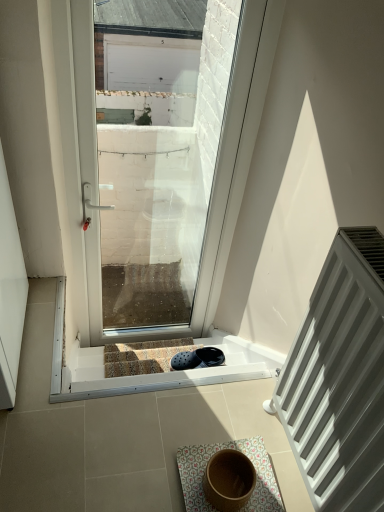
Describe the element at coordinates (143, 356) in the screenshot. This screenshot has width=384, height=512. I see `carpeted stairs at center` at that location.

What is the approximate height of white matte radiator at right?

It is 27.67 inches.

Where is `transparent glass door at center`? The height and width of the screenshot is (512, 384). transparent glass door at center is located at coordinates (162, 162).

Considering the sizes of floral fabric bath mat at center and transparent glass door at center in the image, is floral fabric bath mat at center taller or shorter than transparent glass door at center?

Considering their sizes, floral fabric bath mat at center has less height than transparent glass door at center.

Which is more to the left, floral fabric bath mat at center or transparent glass door at center?

From the viewer's perspective, transparent glass door at center appears more on the left side.

I want to click on bath mat that is on the right side of transparent glass door at center, so click(x=206, y=465).

Does floral fabric bath mat at center turn towards transparent glass door at center?

No, floral fabric bath mat at center is not oriented towards transparent glass door at center.

Is transparent glass door at center bigger than white matte radiator at right?

Correct, transparent glass door at center is larger in size than white matte radiator at right.

Which is more to the left, transparent glass door at center or white matte radiator at right?

From the viewer's perspective, transparent glass door at center appears more on the left side.

Is transparent glass door at center facing towards white matte radiator at right?

Yes, transparent glass door at center faces towards white matte radiator at right.

Based on the photo, can you confirm if transparent glass door at center is shorter than white matte radiator at right?

No, transparent glass door at center is not shorter than white matte radiator at right.

Considering the relative positions of floral fabric bath mat at center and white matte radiator at right in the image provided, is floral fabric bath mat at center to the right of white matte radiator at right from the viewer's perspective?

No, floral fabric bath mat at center is not to the right of white matte radiator at right.

Which is closer, (x=247, y=505) or (x=349, y=338)?

The point (x=349, y=338) is closer to the camera.

From a real-world perspective, between floral fabric bath mat at center and white matte radiator at right, who is vertically lower?

floral fabric bath mat at center is physically lower.

How many degrees apart are the facing directions of white matte radiator at right and carpeted stairs at center?

90 degrees separate the facing orientations of white matte radiator at right and carpeted stairs at center.

Considering the positions of objects white matte radiator at right and carpeted stairs at center in the image provided, who is more to the right, white matte radiator at right or carpeted stairs at center?

white matte radiator at right.

Is white matte radiator at right oriented away from carpeted stairs at center?

No, white matte radiator at right is not facing away from carpeted stairs at center.

Would you say transparent glass door at center is outside floral fabric bath mat at center?

Yes, transparent glass door at center is located beyond the bounds of floral fabric bath mat at center.

Does transparent glass door at center have a lesser height compared to floral fabric bath mat at center?

No.

Locate an element on the screen. This screenshot has height=512, width=384. bath mat that is under the transparent glass door at center (from a real-world perspective) is located at coordinates (206, 465).

Are transparent glass door at center and floral fabric bath mat at center located far from each other?

Absolutely, transparent glass door at center is distant from floral fabric bath mat at center.

Is white matte radiator at right in contact with floral fabric bath mat at center?

No, white matte radiator at right is not next to floral fabric bath mat at center.

Between white matte radiator at right and floral fabric bath mat at center, which one has larger width?

floral fabric bath mat at center.

In terms of height, does white matte radiator at right look taller or shorter compared to floral fabric bath mat at center?

Considering their sizes, white matte radiator at right has more height than floral fabric bath mat at center.

What's the angular difference between floral fabric bath mat at center and carpeted stairs at center's facing directions?

There is a 90-degree angle between the facing directions of floral fabric bath mat at center and carpeted stairs at center.

Considering the relative sizes of floral fabric bath mat at center and carpeted stairs at center in the image provided, is floral fabric bath mat at center taller than carpeted stairs at center?

No, floral fabric bath mat at center is not taller than carpeted stairs at center.

Choose the correct answer: Is floral fabric bath mat at center inside carpeted stairs at center or outside it?

floral fabric bath mat at center is spatially situated outside carpeted stairs at center.

From a real-world perspective, who is located lower, floral fabric bath mat at center or carpeted stairs at center?

carpeted stairs at center.

At what (x,y) coordinates should I click in order to perform the action: click on bath mat below the transparent glass door at center (from a real-world perspective). Please return your answer as a coordinate pair (x, y). Looking at the image, I should click on (206, 465).

Find the location of a particular element. This screenshot has height=512, width=384. window behind the white matte radiator at right is located at coordinates (162, 162).

Based on their spatial positions, is carpeted stairs at center or floral fabric bath mat at center closer to transparent glass door at center?

carpeted stairs at center is positioned closer to the anchor transparent glass door at center.

Estimate the real-world distances between objects in this image. Which object is closer to carpeted stairs at center, white matte radiator at right or transparent glass door at center?

Among the two, white matte radiator at right is located nearer to carpeted stairs at center.

Considering their positions, is floral fabric bath mat at center positioned closer to transparent glass door at center than carpeted stairs at center?

carpeted stairs at center is positioned closer to the anchor transparent glass door at center.

Looking at the image, which one is located further to transparent glass door at center, carpeted stairs at center or white matte radiator at right?

white matte radiator at right is positioned further to the anchor transparent glass door at center.

Looking at the image, which one is located further to white matte radiator at right, carpeted stairs at center or floral fabric bath mat at center?

carpeted stairs at center lies further to white matte radiator at right than the other object.

Based on their spatial positions, is carpeted stairs at center or transparent glass door at center further from floral fabric bath mat at center?

The object further to floral fabric bath mat at center is transparent glass door at center.

Which object lies further to the anchor point floral fabric bath mat at center, carpeted stairs at center or white matte radiator at right?

Based on the image, carpeted stairs at center appears to be further to floral fabric bath mat at center.

When comparing their distances from floral fabric bath mat at center, does white matte radiator at right or transparent glass door at center seem closer?

white matte radiator at right is positioned closer to the anchor floral fabric bath mat at center.

This screenshot has height=512, width=384. In order to click on bath mat positioned between white matte radiator at right and carpeted stairs at center from near to far in this screenshot , I will do `click(206, 465)`.

The image size is (384, 512). What are the coordinates of `window located between white matte radiator at right and carpeted stairs at center in the depth direction` in the screenshot? It's located at (162, 162).

Image resolution: width=384 pixels, height=512 pixels. What are the coordinates of `radiator between transparent glass door at center and floral fabric bath mat at center in the up-down direction` in the screenshot? It's located at (340, 378).

Locate an element on the screen. window positioned between floral fabric bath mat at center and carpeted stairs at center from near to far is located at coordinates (162, 162).